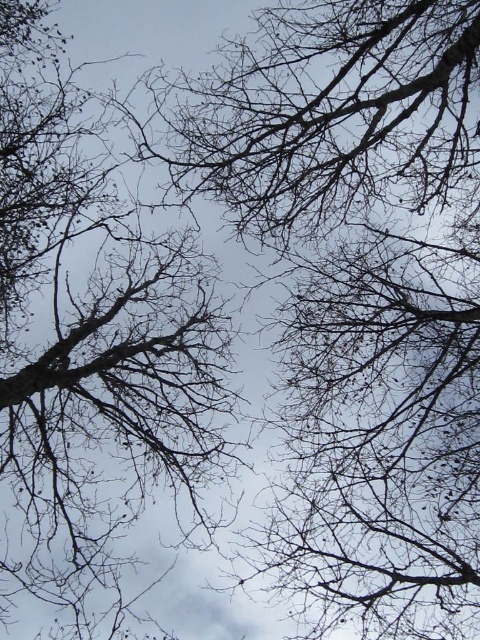
Question: Which of the following is the farthest from the observer?

Choices:
 (A) (167, 445)
 (B) (208, 148)

Answer: (A)

Question: Among these objects, which one is farthest from the camera?

Choices:
 (A) dark brown branches at upper center
 (B) bare branches at center

Answer: (B)

Question: Which of the following is the closest to the observer?

Choices:
 (A) bare branches at center
 (B) dark brown branches at upper center

Answer: (B)

Question: Observing the image, what is the correct spatial positioning of bare branches at center in reference to dark brown branches at upper center?

Choices:
 (A) left
 (B) right

Answer: (A)

Question: Does bare branches at center have a greater width compared to dark brown branches at upper center?

Choices:
 (A) no
 (B) yes

Answer: (A)

Question: Is bare branches at center smaller than dark brown branches at upper center?

Choices:
 (A) yes
 (B) no

Answer: (B)